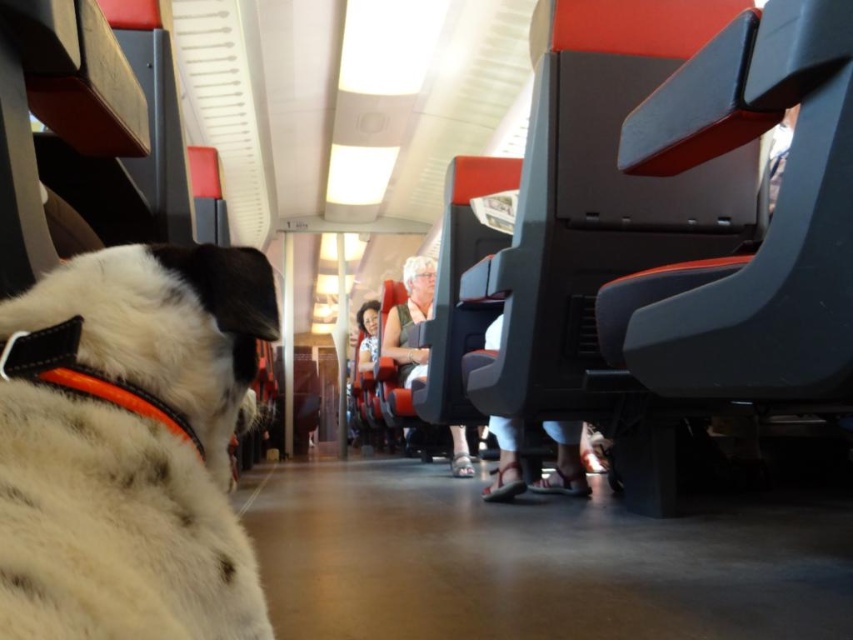
You are a passenger sitting in the train and you notice two white items in the scene. One is the white fur at left and the other is the white fabric pants at center. Which one is covering the other?

The white fur at left is positioned over white fabric pants at center, so the white fur at left is covering the white fabric pants at center.

You are a passenger sitting in the train and looking at the scene. There is a white fur at left and a white fabric pants at center. Which one is taller?

The white fur at left is taller than the white fabric pants at center.